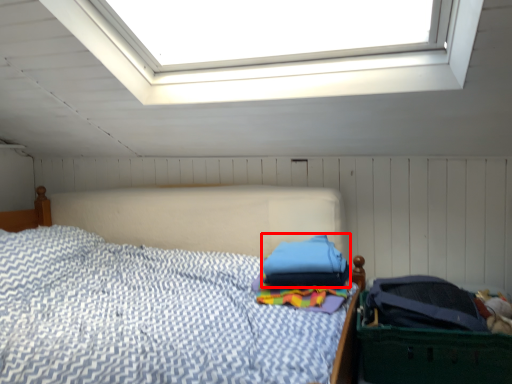
Question: Considering the relative positions of pillow (annotated by the red box) and laundry basket in the image provided, where is pillow (annotated by the red box) located with respect to the staircase?

Choices:
 (A) left
 (B) right

Answer: (A)